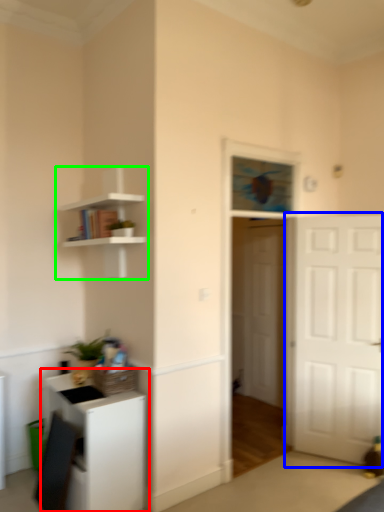
Question: Which object is positioned closest to cabinetry (highlighted by a red box)? Select from door (highlighted by a blue box) and shelf (highlighted by a green box).

Choices:
 (A) door
 (B) shelf

Answer: (B)